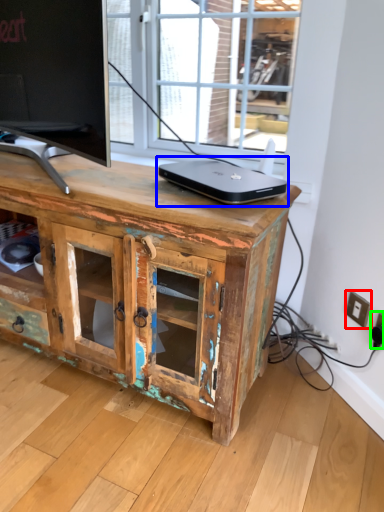
Question: Which object is the closest to the electric outlet (highlighted by a red box)? Choose among these: laptop (highlighted by a blue box) or electric outlet (highlighted by a green box).

Choices:
 (A) laptop
 (B) electric outlet

Answer: (B)